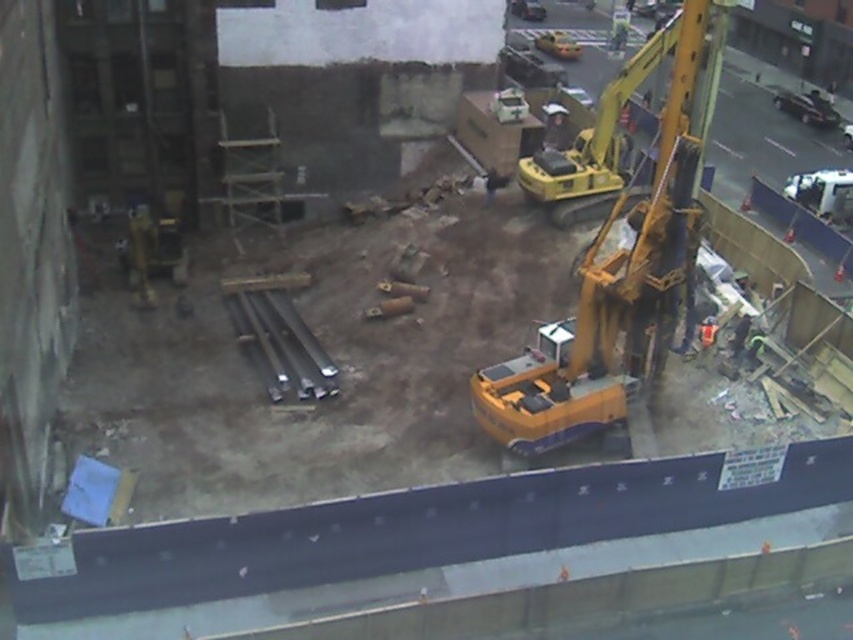
Which is behind, point (590, 355) or point (561, 118)?

The point (561, 118) is behind.

In the scene shown: Does yellow metallic excavator at center come in front of yellow hard hat at center?

That is True.

Between point (631, 323) and point (567, 131), which one is positioned behind?

The point (567, 131) is more distant.

Locate an element on the screen. The height and width of the screenshot is (640, 853). yellow metallic excavator at center is located at coordinates (619, 259).